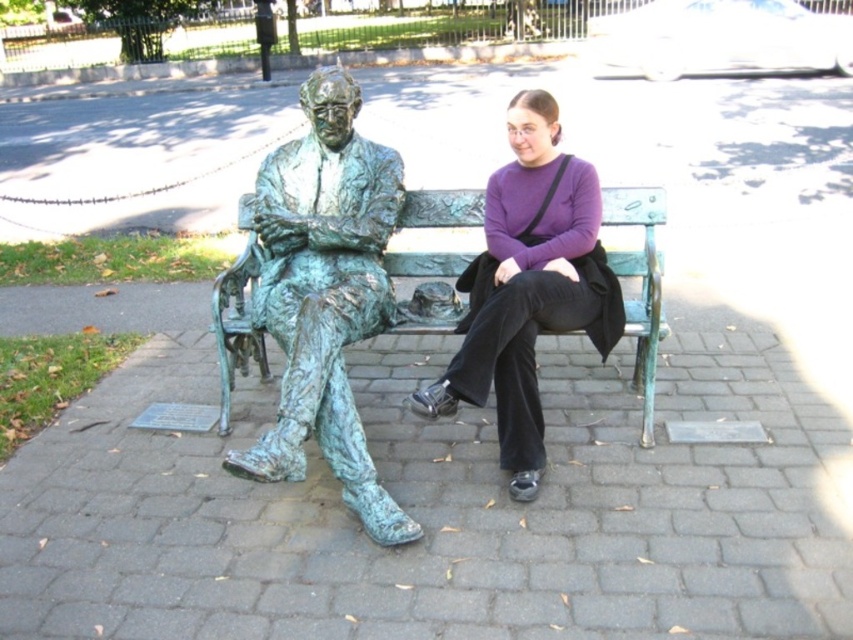
You are standing at the entrance of the park and see the green patina bronze statue at center and the green patina bench at center. Which object is closer to you?

The green patina bronze statue at center is closer to you because it is positioned in front of the green patina bench at center.

You are a park maintenance worker who needs to move the purple matte sweater at center and the green patina bench at center to different locations. Based on their sizes, which object would require more space when moving?

The purple matte sweater at center might be wider than the green patina bench at center, so it would likely require more space when moving.